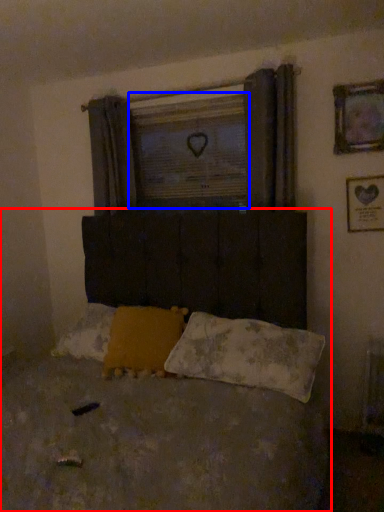
Question: Which object is closer to the camera taking this photo, bed (highlighted by a red box) or window screen (highlighted by a blue box)?

Choices:
 (A) bed
 (B) window screen

Answer: (A)